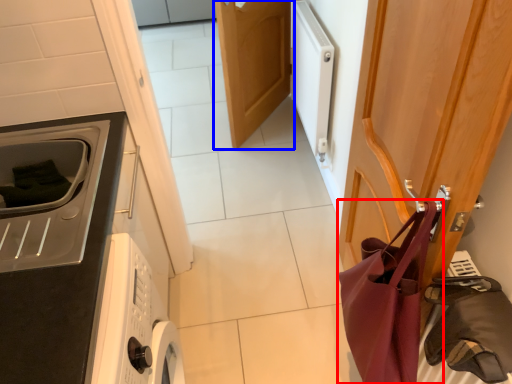
Question: Among these objects, which one is farthest to the camera, shoulder bag (highlighted by a red box) or door (highlighted by a blue box)?

Choices:
 (A) shoulder bag
 (B) door

Answer: (B)